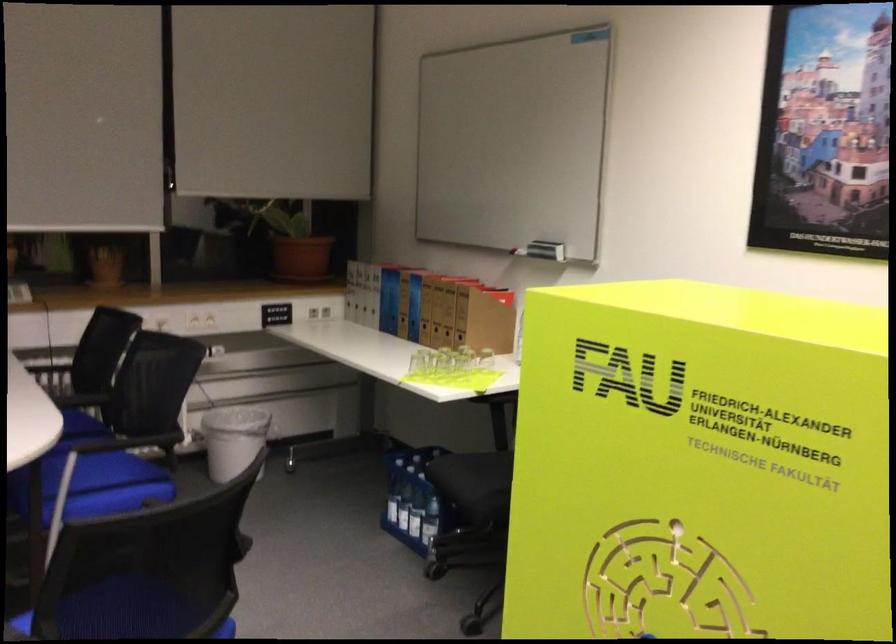
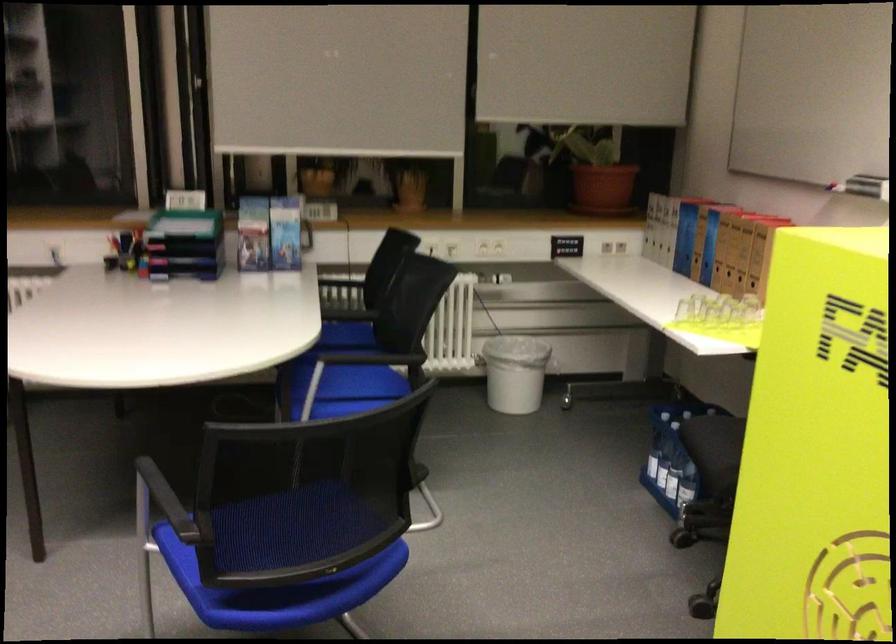
In the second image, find the point that corresponds to point (89, 477) in the first image.

(349, 382)